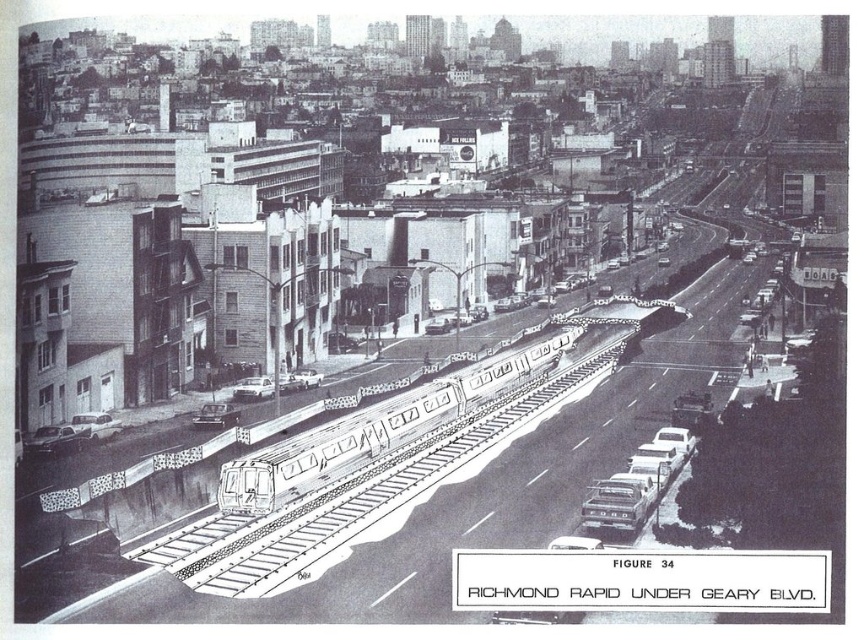
Who is lower down, shiny silver sedan at center-left or metallic silver car at center-left?

shiny silver sedan at center-left is lower down.

Is point (208, 406) positioned before point (267, 384)?

That is True.

At what (x,y) coordinates should I click in order to perform the action: click on shiny silver sedan at center-left. Please return your answer as a coordinate pair (x, y). This screenshot has width=864, height=640. Looking at the image, I should click on (216, 416).

Consider the image. Is white glossy sedan at center-right above shiny silver sedan at center-left?

Incorrect, white glossy sedan at center-right is not positioned above shiny silver sedan at center-left.

Image resolution: width=864 pixels, height=640 pixels. I want to click on white glossy sedan at center-right, so click(638, 483).

Does smooth silver train at center have a lesser height compared to shiny silver sedan at center-left?

Incorrect, smooth silver train at center's height does not fall short of shiny silver sedan at center-left's.

From the picture: Is smooth silver train at center to the left of shiny silver sedan at center-left from the viewer's perspective?

In fact, smooth silver train at center is to the right of shiny silver sedan at center-left.

Image resolution: width=864 pixels, height=640 pixels. Describe the element at coordinates (369, 433) in the screenshot. I see `smooth silver train at center` at that location.

Locate an element on the screen. smooth silver train at center is located at coordinates (369, 433).